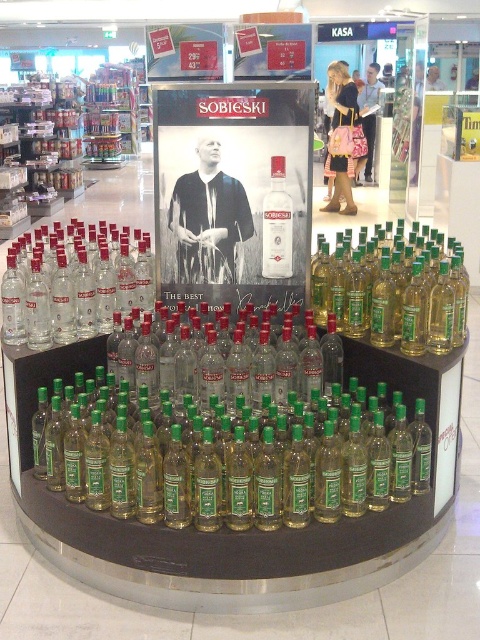
You are a customer in the store looking for the green glass bottle at right. According to the store layout, where should you look to find it?

The green glass bottle at right is located at point (459, 296).

You are a store employee checking the promotional display for Sobieski vodka. You notice the matte black poster at center and the transparent glass bottles at left. Which object is smaller in size?

The matte black poster at center has a smaller size compared to the transparent glass bottles at left.

You are a customer looking at the Sobieski vodka display. You see a green glass bottle at right and a clear glass bottle at center. Which bottle is positioned lower on the display?

The green glass bottle at right is located below the clear glass bottle at center, so it is positioned lower on the display.